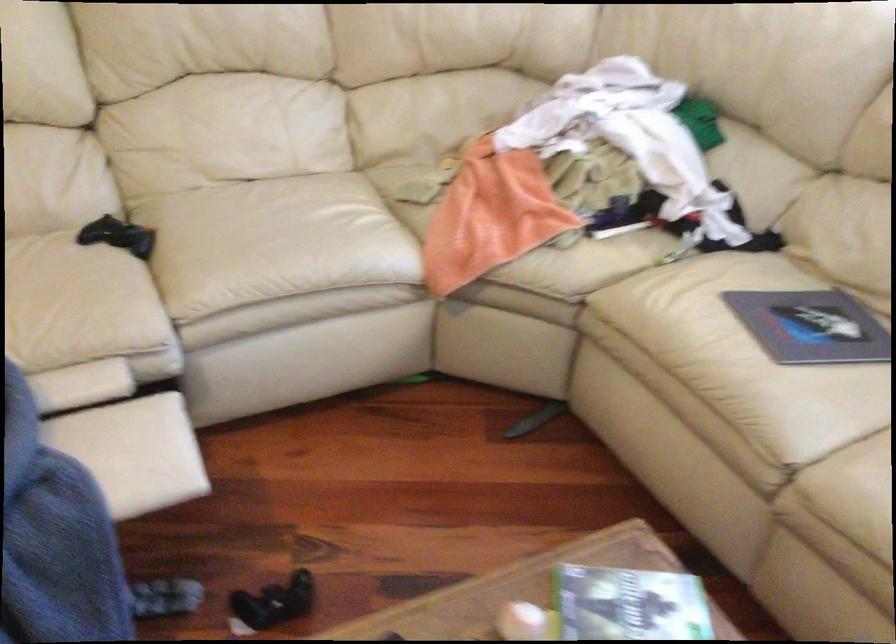
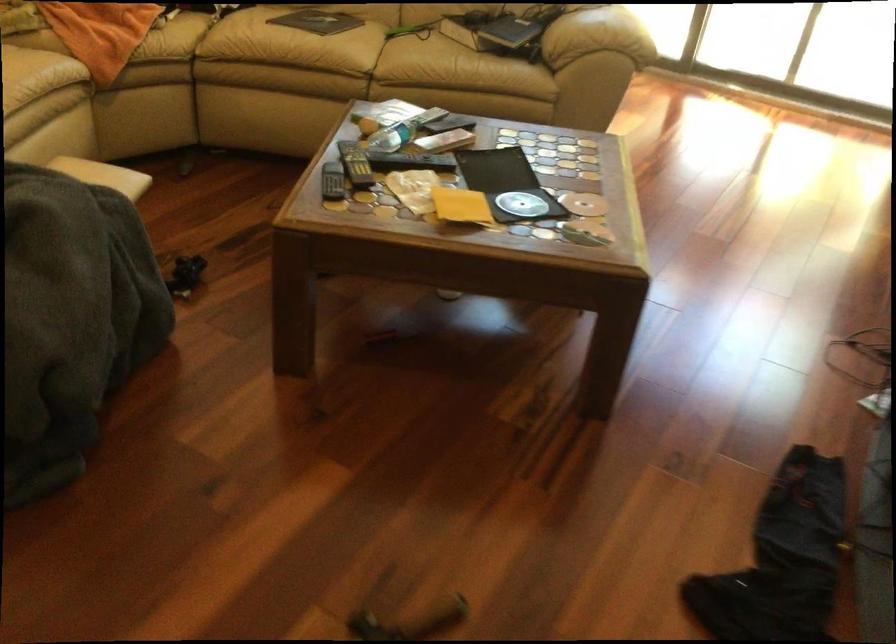
Find the pixel in the second image that matches pixel 767 398 in the first image.

(334, 58)